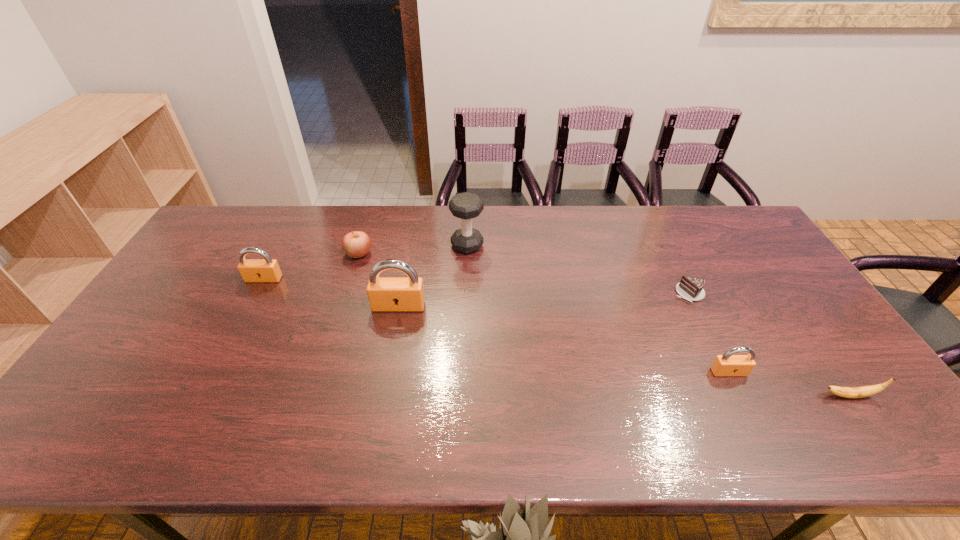
Locate an element on the screen. This screenshot has width=960, height=540. dumbbell that is at the far edge is located at coordinates (466, 206).

I want to click on padlock that is at the near edge, so click(728, 364).

The height and width of the screenshot is (540, 960). In order to click on banana present at the near edge in this screenshot , I will do `click(848, 392)`.

The height and width of the screenshot is (540, 960). Identify the location of object that is at the right edge. (848, 392).

The image size is (960, 540). What are the coordinates of `object that is at the near right corner` in the screenshot? It's located at (848, 392).

Identify the location of free space at the far edge. The height and width of the screenshot is (540, 960). (573, 217).

Find the location of a particular element. This screenshot has height=540, width=960. free space at the near edge of the desktop is located at coordinates (492, 390).

At what (x,y) coordinates should I click in order to perform the action: click on vacant space at the right edge. Please return your answer as a coordinate pair (x, y). The width and height of the screenshot is (960, 540). Looking at the image, I should click on (831, 365).

This screenshot has width=960, height=540. In order to click on free location at the far left corner of the desktop in this screenshot , I will do `click(234, 210)`.

Identify the location of unoccupied position between the chocolate cake and the apple. The image size is (960, 540). (524, 274).